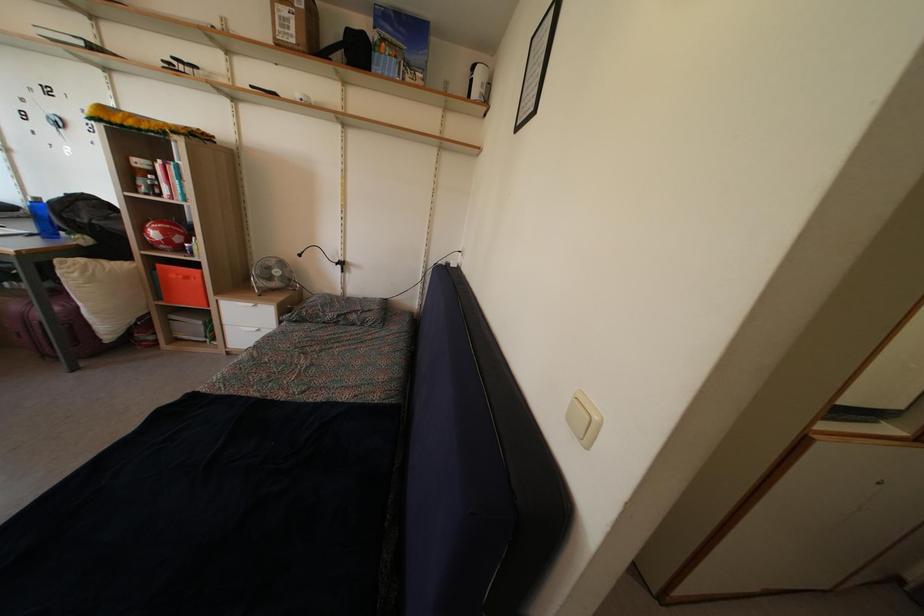
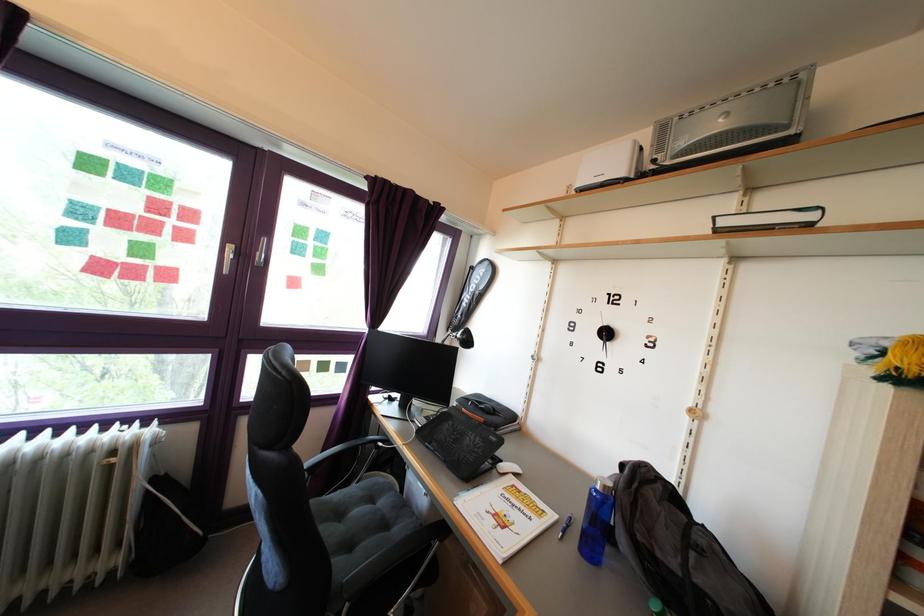
Locate, in the second image, the point that corresponds to point (40, 208) in the first image.

(609, 496)